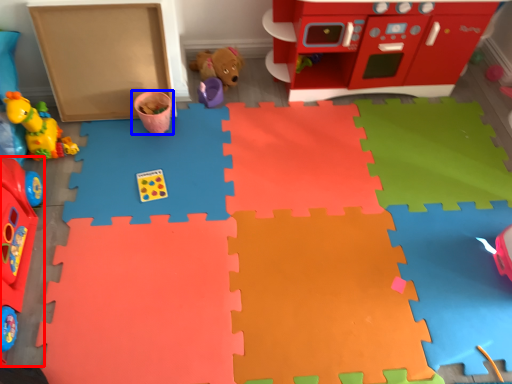
Question: Among these objects, which one is nearest to the camera, toy (highlighted by a red box) or toy (highlighted by a blue box)?

Choices:
 (A) toy
 (B) toy

Answer: (A)